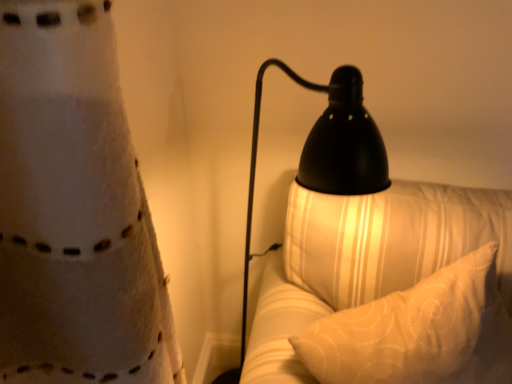
This screenshot has width=512, height=384. What do you see at coordinates (327, 150) in the screenshot? I see `black matte lamp at right` at bounding box center [327, 150].

The image size is (512, 384). Find the location of `black matte lamp at right`. black matte lamp at right is located at coordinates (327, 150).

What is the approximate width of black matte lamp at right?

The width of black matte lamp at right is 16.88 inches.

Image resolution: width=512 pixels, height=384 pixels. Find the location of `white textured pillow at right`. white textured pillow at right is located at coordinates (403, 330).

The height and width of the screenshot is (384, 512). Describe the element at coordinates (403, 330) in the screenshot. I see `white textured pillow at right` at that location.

The width and height of the screenshot is (512, 384). In order to click on black matte lamp at right in this screenshot , I will do `click(327, 150)`.

Between white textured pillow at right and black matte lamp at right, which one appears on the right side from the viewer's perspective?

From the viewer's perspective, white textured pillow at right appears more on the right side.

Does white textured pillow at right come behind black matte lamp at right?

Yes.

Is point (416, 318) behind point (339, 68)?

That is True.

From the image's perspective, does white textured pillow at right appear higher than black matte lamp at right?

Incorrect, from the image's perspective, white textured pillow at right is lower than black matte lamp at right.

From a real-world perspective, is white textured pillow at right over black matte lamp at right?

Actually, white textured pillow at right is physically below black matte lamp at right in the real world.

In terms of width, does white textured pillow at right look wider or thinner when compared to black matte lamp at right?

Clearly, white textured pillow at right has less width compared to black matte lamp at right.

Considering the sizes of objects white textured pillow at right and black matte lamp at right in the image provided, who is taller, white textured pillow at right or black matte lamp at right?

Standing taller between the two is black matte lamp at right.

Based on the photo, between white textured pillow at right and black matte lamp at right, which one has larger size?

Bigger between the two is white textured pillow at right.

Is black matte lamp at right a part of white textured pillow at right?

No, black matte lamp at right is not surrounded by white textured pillow at right.

Are white textured pillow at right and black matte lamp at right located far from each other?

white textured pillow at right is near black matte lamp at right, not far away.

Is white textured pillow at right aimed at black matte lamp at right?

No, white textured pillow at right is not oriented towards black matte lamp at right.

Based on the photo, how many degrees apart are the facing directions of white textured pillow at right and black matte lamp at right?

42.2 degrees.

Where is `lamp above the white textured pillow at right (from the image's perspective)`? lamp above the white textured pillow at right (from the image's perspective) is located at coordinates (327, 150).

Between black matte lamp at right and white textured pillow at right, which one appears on the left side from the viewer's perspective?

Positioned to the left is black matte lamp at right.

Between black matte lamp at right and white textured pillow at right, which one is positioned behind?

white textured pillow at right is more distant.

Which is closer to the camera, (x=307, y=161) or (x=481, y=303)?

Clearly, point (x=307, y=161) is closer to the camera than point (x=481, y=303).

From the image's perspective, would you say black matte lamp at right is shown under white textured pillow at right?

No, from the image's perspective, black matte lamp at right is not below white textured pillow at right.

From a real-world perspective, which object rests below the other?

white textured pillow at right.

Based on the photo, considering the relative sizes of black matte lamp at right and white textured pillow at right in the image provided, is black matte lamp at right thinner than white textured pillow at right?

In fact, black matte lamp at right might be wider than white textured pillow at right.

Does black matte lamp at right have a greater height compared to white textured pillow at right?

Correct, black matte lamp at right is much taller as white textured pillow at right.

Based on their sizes in the image, would you say black matte lamp at right is bigger or smaller than white textured pillow at right?

black matte lamp at right is smaller than white textured pillow at right.

Is black matte lamp at right positioned beyond the bounds of white textured pillow at right?

Yes, black matte lamp at right is outside of white textured pillow at right.

Is black matte lamp at right positioned far away from white textured pillow at right?

They are positioned close to each other.

Is black matte lamp at right looking in the opposite direction of white textured pillow at right?

No, black matte lamp at right is not facing away from white textured pillow at right.

What's the angular difference between black matte lamp at right and white textured pillow at right's facing directions?

The facing directions of black matte lamp at right and white textured pillow at right are 42.2 degrees apart.

What are the coordinates of `lamp that is above the white textured pillow at right (from the image's perspective)` in the screenshot? It's located at (327, 150).

At what (x,y) coordinates should I click in order to perform the action: click on lamp on the left of white textured pillow at right. Please return your answer as a coordinate pair (x, y). The width and height of the screenshot is (512, 384). Looking at the image, I should click on (327, 150).

This screenshot has height=384, width=512. In order to click on lamp that is above the white textured pillow at right (from the image's perspective) in this screenshot , I will do `click(327, 150)`.